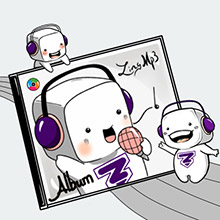
The image size is (220, 220). I want to click on cd case, so click(x=19, y=92).